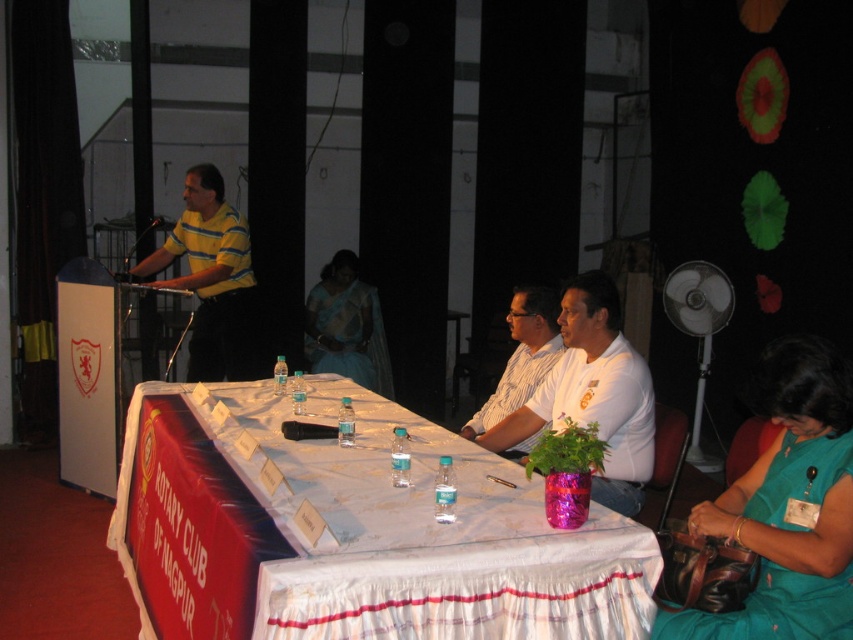
Question: Does yellow striped shirt at left lie behind silk sari at center?

Choices:
 (A) yes
 (B) no

Answer: (B)

Question: Which of the following is the farthest from the observer?

Choices:
 (A) white cloth-covered table at center
 (B) teal fabric dress at lower right
 (C) white striped shirt at center

Answer: (C)

Question: Is white cloth-covered table at center positioned at the back of teal fabric dress at lower right?

Choices:
 (A) no
 (B) yes

Answer: (A)

Question: Which of these objects is positioned closest to the white cloth-covered table at center?

Choices:
 (A) silk sari at center
 (B) white matte shirt at center
 (C) yellow striped shirt at left

Answer: (B)

Question: From the image, what is the correct spatial relationship of yellow striped shirt at left in relation to silk sari at center?

Choices:
 (A) left
 (B) right

Answer: (A)

Question: Which of these objects is positioned farthest from the yellow striped shirt at left?

Choices:
 (A) white striped shirt at center
 (B) teal fabric dress at lower right
 (C) white cloth-covered table at center
 (D) white matte shirt at center

Answer: (B)